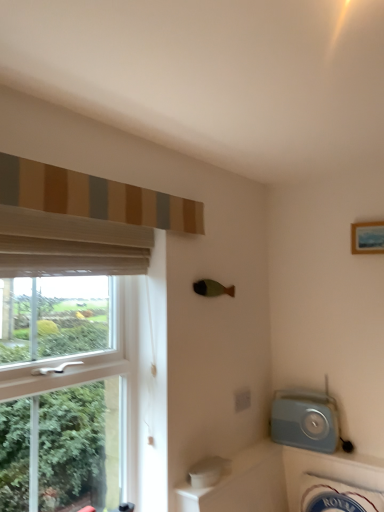
Question: Is wooden framed picture at upper right positioned with its back to white sheer curtain at left, which is the 2th curtain from top to bottom?

Choices:
 (A) yes
 (B) no

Answer: (B)

Question: Is the position of wooden framed picture at upper right more distant than that of white sheer curtain at left, which appears as the first curtain when ordered from the bottom?

Choices:
 (A) no
 (B) yes

Answer: (B)

Question: Considering the relative sizes of wooden framed picture at upper right and white sheer curtain at left, which appears as the first curtain when ordered from the bottom, in the image provided, is wooden framed picture at upper right thinner than white sheer curtain at left, which appears as the first curtain when ordered from the bottom,?

Choices:
 (A) no
 (B) yes

Answer: (B)

Question: Is wooden framed picture at upper right to the right of white sheer curtain at left, which appears as the first curtain when ordered from the bottom, from the viewer's perspective?

Choices:
 (A) no
 (B) yes

Answer: (B)

Question: From a real-world perspective, does wooden framed picture at upper right sit lower than white sheer curtain at left, which appears as the first curtain when ordered from the bottom?

Choices:
 (A) yes
 (B) no

Answer: (B)

Question: Considering the positions of point (61, 263) and point (340, 461), is point (61, 263) closer or farther from the camera than point (340, 461)?

Choices:
 (A) closer
 (B) farther

Answer: (A)

Question: Considering the positions of white sheer curtain at left, which appears as the first curtain when ordered from the bottom, and white ceramic bath at lower right in the image, is white sheer curtain at left, which appears as the first curtain when ordered from the bottom, taller or shorter than white ceramic bath at lower right?

Choices:
 (A) tall
 (B) short

Answer: (B)

Question: From a real-world perspective, relative to white ceramic bath at lower right, is white sheer curtain at left, which appears as the first curtain when ordered from the bottom, vertically above or below?

Choices:
 (A) above
 (B) below

Answer: (A)

Question: Considering the positions of white sheer curtain at left, which appears as the first curtain when ordered from the bottom, and white ceramic bath at lower right in the image, is white sheer curtain at left, which appears as the first curtain when ordered from the bottom, bigger or smaller than white ceramic bath at lower right?

Choices:
 (A) small
 (B) big

Answer: (A)

Question: Is wooden framed picture at upper right to the left or to the right of striped fabric curtain at upper left, the 2th curtain when ordered from bottom to top, in the image?

Choices:
 (A) right
 (B) left

Answer: (A)

Question: Considering the positions of wooden framed picture at upper right and striped fabric curtain at upper left, the first curtain in the top-to-bottom sequence, in the image, is wooden framed picture at upper right taller or shorter than striped fabric curtain at upper left, the first curtain in the top-to-bottom sequence,?

Choices:
 (A) tall
 (B) short

Answer: (B)

Question: Looking at the image, does wooden framed picture at upper right seem bigger or smaller compared to striped fabric curtain at upper left, the 2th curtain when ordered from bottom to top?

Choices:
 (A) big
 (B) small

Answer: (B)

Question: From the image's perspective, relative to striped fabric curtain at upper left, the first curtain in the top-to-bottom sequence, is wooden framed picture at upper right above or below?

Choices:
 (A) above
 (B) below

Answer: (B)

Question: From a real-world perspective, is wooden framed picture at upper right above or below white ceramic bath at lower right?

Choices:
 (A) below
 (B) above

Answer: (B)

Question: Based on their sizes in the image, would you say wooden framed picture at upper right is bigger or smaller than white ceramic bath at lower right?

Choices:
 (A) small
 (B) big

Answer: (A)